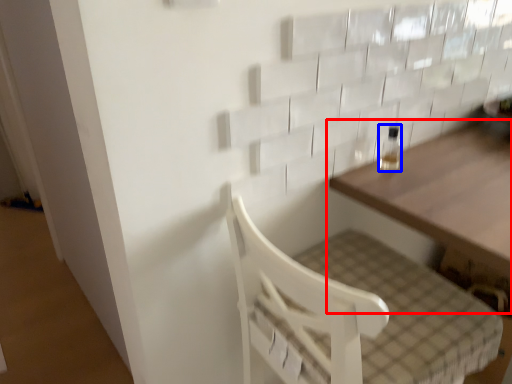
Question: Which of the following is the closest to the observer, table (highlighted by a red box) or bottle (highlighted by a blue box)?

Choices:
 (A) table
 (B) bottle

Answer: (A)